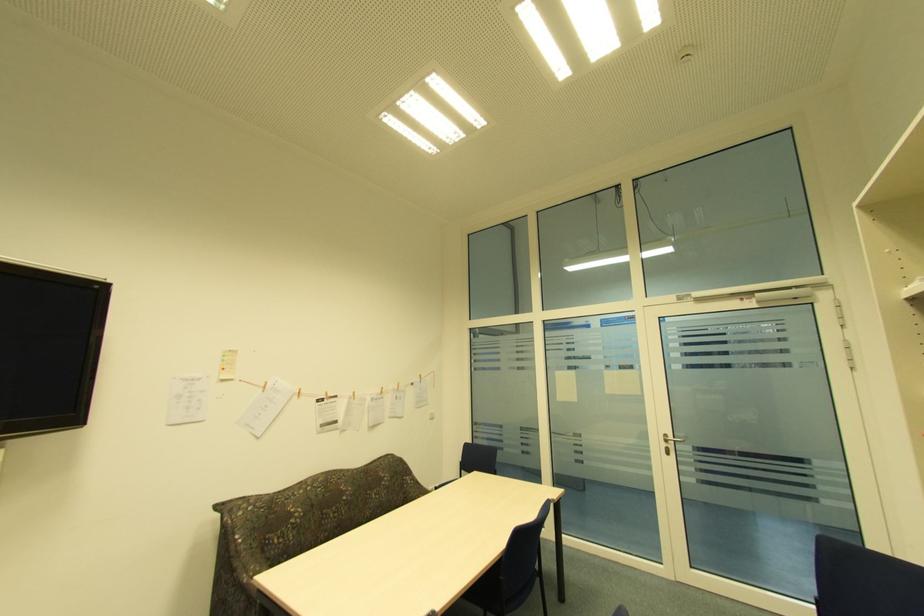
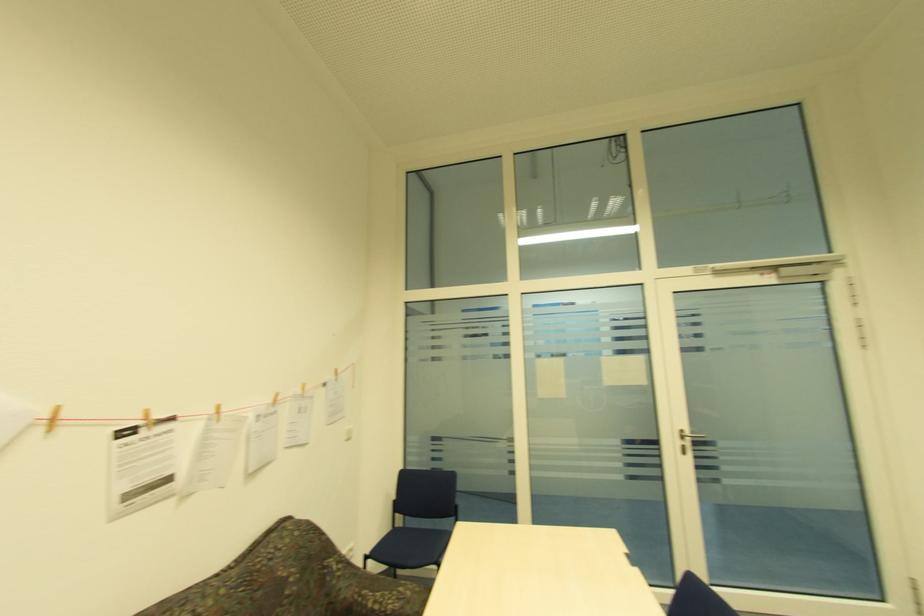
Find the pixel in the second image that matches pixel 357 395 in the first image.

(219, 413)